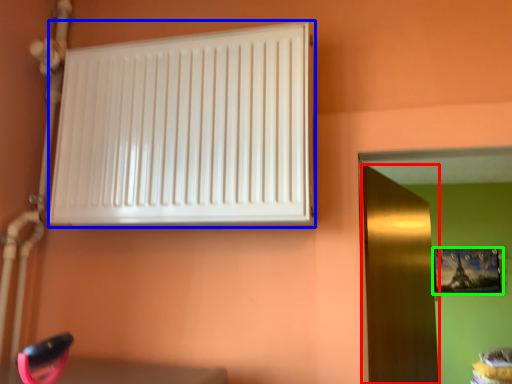
Question: Considering the real-world distances, which object is farthest from door (highlighted by a red box)? radiator (highlighted by a blue box) or picture frame (highlighted by a green box)?

Choices:
 (A) radiator
 (B) picture frame

Answer: (B)